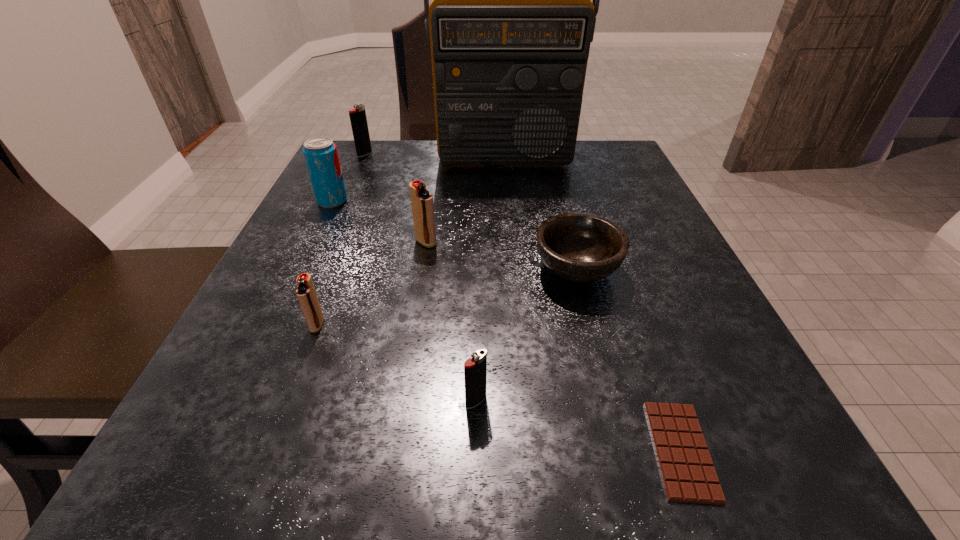
At what (x,y) coordinates should I click in order to perform the action: click on the tallest object. Please return your answer as a coordinate pair (x, y). Looking at the image, I should click on (511, 22).

Image resolution: width=960 pixels, height=540 pixels. Identify the location of soda can. (320, 153).

You are a GUI agent. You are given a task and a screenshot of the screen. Output one action in this format:
    pyautogui.click(x=<x>, y=<y>)
    Task: Click on the farthest igniter
    This screenshot has width=960, height=540.
    Given the screenshot: What is the action you would take?
    pyautogui.click(x=358, y=119)

Where is `the left black igniter`? the left black igniter is located at coordinates click(358, 119).

Where is `the bigger red igniter`? This screenshot has height=540, width=960. the bigger red igniter is located at coordinates (421, 200).

Where is `the farther red igniter`? This screenshot has width=960, height=540. the farther red igniter is located at coordinates (421, 200).

Identify the location of the nearer red igniter. This screenshot has width=960, height=540. (306, 294).

You are a GUI agent. You are given a task and a screenshot of the screen. Output one action in this format:
    pyautogui.click(x=<x>, y=<y>)
    Task: Click on the left red igniter
    The image size is (960, 540).
    Given the screenshot: What is the action you would take?
    pyautogui.click(x=306, y=294)

I want to click on the nearer black igniter, so click(475, 369).

Identify the location of the right black igniter. (475, 369).